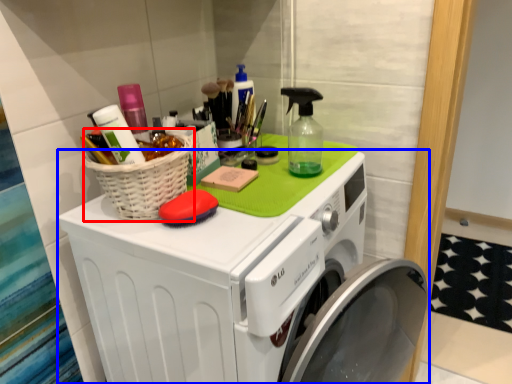
Question: Among these objects, which one is nearest to the camera, basket (highlighted by a red box) or washing machine (highlighted by a blue box)?

Choices:
 (A) basket
 (B) washing machine

Answer: (B)